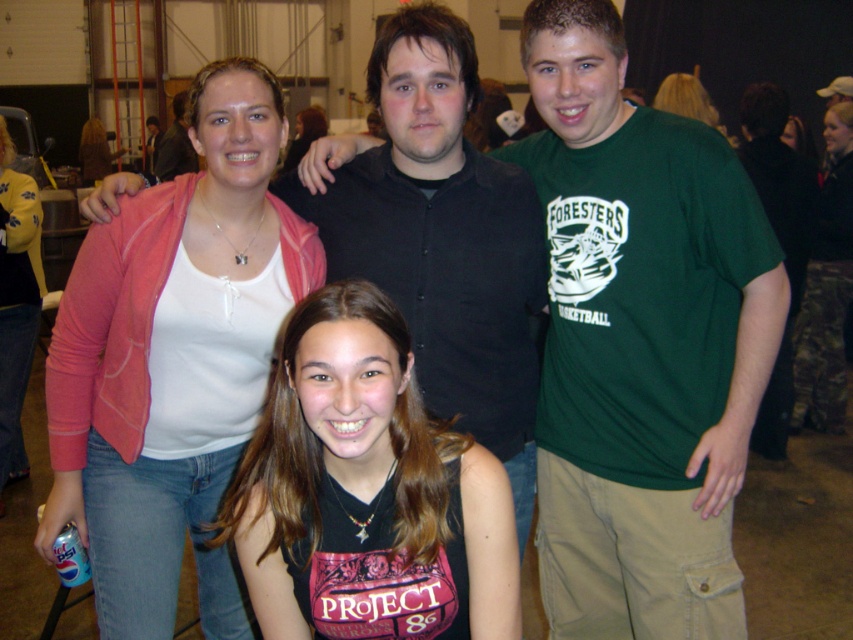
Question: Can you confirm if pink fabric at upper left is bigger than matte yellow jacket at upper left?

Choices:
 (A) no
 (B) yes

Answer: (B)

Question: Is the position of black matte tank top at center more distant than that of matte yellow jacket at upper left?

Choices:
 (A) yes
 (B) no

Answer: (B)

Question: Does matte yellow jacket at upper left have a lesser width compared to blonde hair at upper center?

Choices:
 (A) no
 (B) yes

Answer: (B)

Question: Which object is farther from the camera taking this photo?

Choices:
 (A) black shirt at upper center
 (B) matte black tank top at center

Answer: (B)

Question: Among these objects, which one is nearest to the camera?

Choices:
 (A) matte black tank top at center
 (B) matte yellow jacket at upper left

Answer: (B)

Question: Which is farther from the green cotton t-shirt at center?

Choices:
 (A) matte black tank top at center
 (B) matte yellow jacket at upper left

Answer: (B)